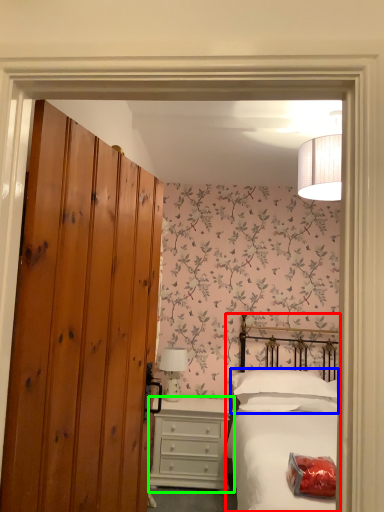
Question: Which object is the closest to the bed (highlighted by a red box)? Choose among these: pillow (highlighted by a blue box) or chest of drawers (highlighted by a green box).

Choices:
 (A) pillow
 (B) chest of drawers

Answer: (A)